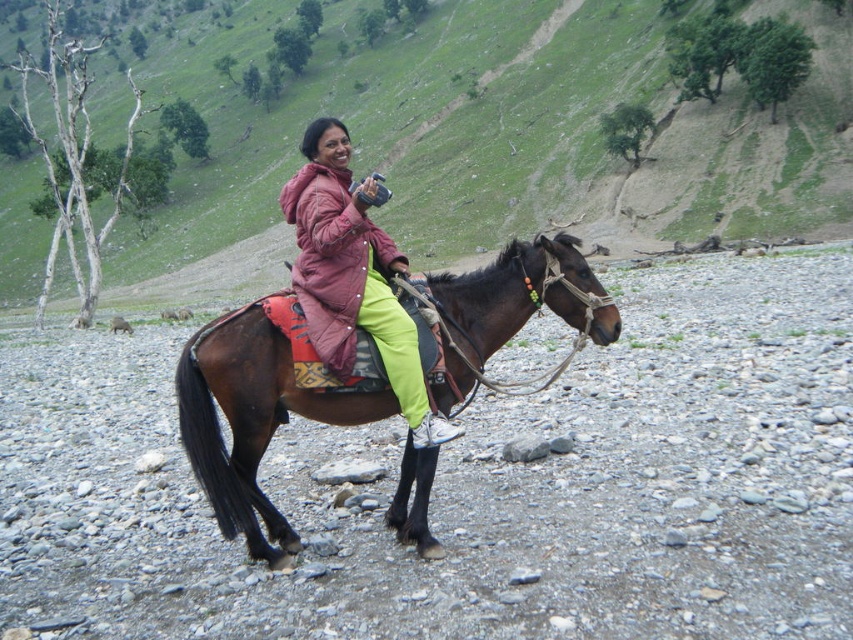
You are a photographer trying to capture the brown glossy horse at center in your shot. The camera you are using has a focal length of 50mm and you are positioned at point 0.5,0.5. Can you determine if the horse is within the camera frame?

The brown glossy horse at center is located at point (253, 417), which is outside the camera frame centered at (426, 320) with a 50mm focal length. To capture the horse, you need to adjust your position or zoom level.

You are a photographer trying to capture a clear shot of the matte pink jacket at center while also including the brown horse at center in the frame. Based on their positions, which object should you focus on first to ensure both are in focus?

The brown horse at center is further to the viewer than the matte pink jacket at center, so you should focus on the brown horse at center first to ensure both are in focus.

Where is the brown horse at center located in the image?

The brown horse at center is located at point (x=509, y=144).